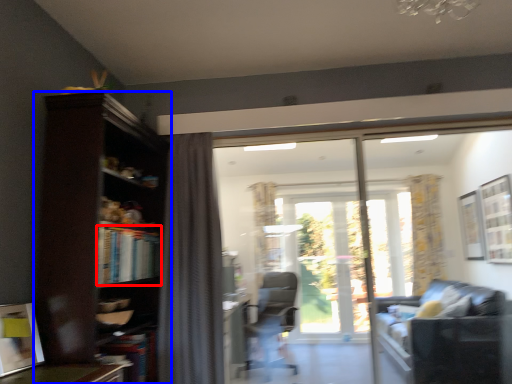
Question: Which point is closer to the camera, book (highlighted by a red box) or bookcase (highlighted by a blue box)?

Choices:
 (A) book
 (B) bookcase

Answer: (B)